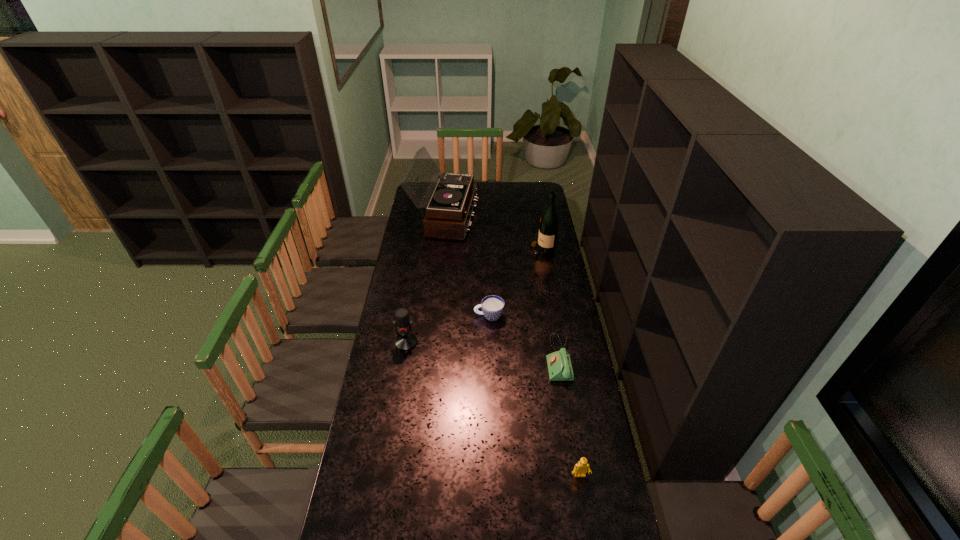
Where is `record player`? The image size is (960, 540). record player is located at coordinates (448, 213).

Image resolution: width=960 pixels, height=540 pixels. I want to click on wine bottle, so click(x=548, y=229).

Locate an element on the screen. Image resolution: width=960 pixels, height=540 pixels. microphone is located at coordinates (405, 341).

At what (x,y) coordinates should I click in order to perform the action: click on the nearest object. Please return your answer as a coordinate pair (x, y). Looking at the image, I should click on (580, 468).

This screenshot has height=540, width=960. In order to click on the third shortest object in this screenshot , I will do `click(580, 468)`.

Locate an element on the screen. This screenshot has height=540, width=960. cup is located at coordinates (492, 306).

Find the location of a particular element. The image size is (960, 540). telephone is located at coordinates (559, 365).

You are a GUI agent. You are given a task and a screenshot of the screen. Output one action in this format:
    pyautogui.click(x=<x>, y=<y>)
    Task: Click on the free space located on the right of the farthest object
    This screenshot has height=540, width=960.
    Given the screenshot: What is the action you would take?
    pyautogui.click(x=492, y=218)

At what (x,y) coordinates should I click in order to perform the action: click on vacant region located 0.380m on the surface of the second farthest object. Please return your answer as a coordinate pair (x, y). Image resolution: width=960 pixels, height=540 pixels. Looking at the image, I should click on (459, 251).

Where is `free location located 0.390m on the surface of the second farthest object`? The width and height of the screenshot is (960, 540). free location located 0.390m on the surface of the second farthest object is located at coordinates (457, 251).